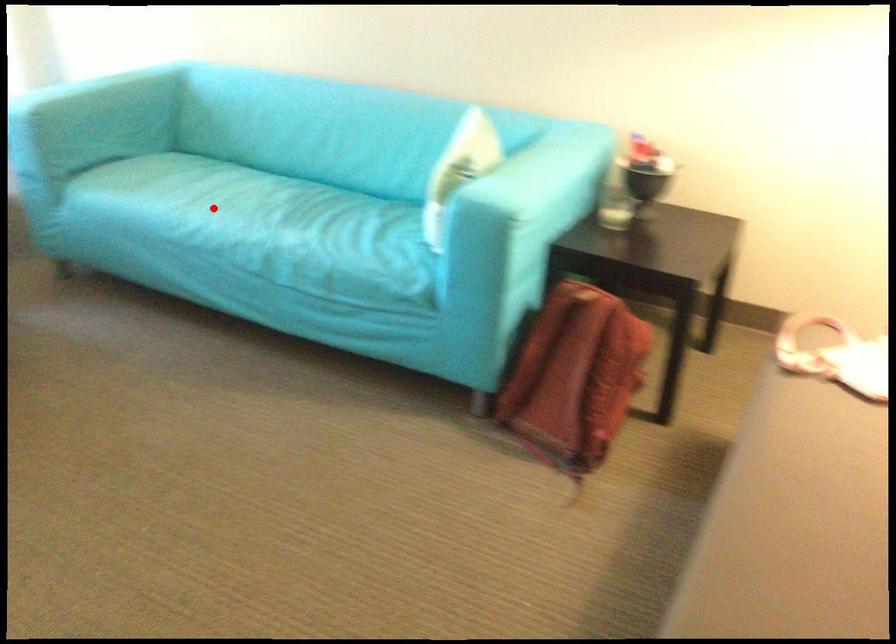
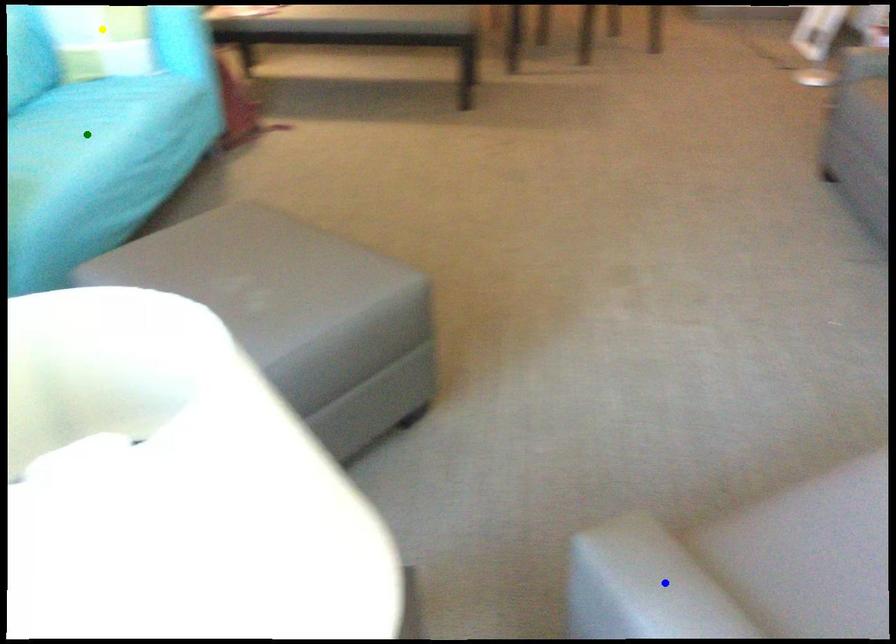
Question: I am providing you with two images of the same scene from different viewpoints. A red point is marked on the first image. You are given multiple points on the second image. Which mark in image 2 goes with the point in image 1?

Choices:
 (A) green point
 (B) blue point
 (C) yellow point

Answer: (A)